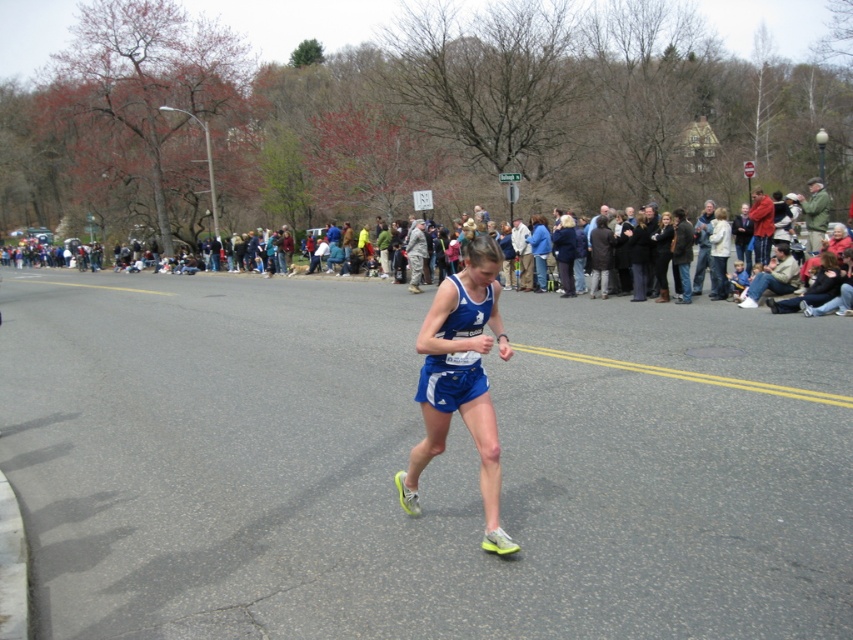
You are a photographer standing at the starting line of the marathon. You want to take a photo that includes both the point at (483, 486) and the point at (805, 314). Which point will appear larger in your photo?

Point at (483, 486) will appear larger in the photo because it is closer to the camera than point at (805, 314).

You are a photographer positioned at the center of the image. You want to capture a closeup shot of the blue fabric shorts at center. Based on the scene description, where should you aim your camera?

The blue fabric shorts at center are located at the 2D coordinates point (461, 380), so you should aim your camera at that point to capture the closeup.